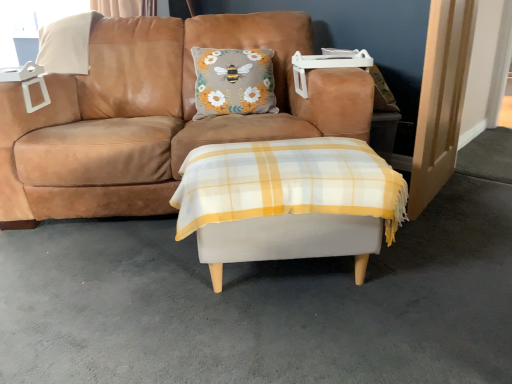
Find the location of a particular element. The height and width of the screenshot is (384, 512). free space above white fabric ottoman at center (from a real-world perspective) is located at coordinates (274, 153).